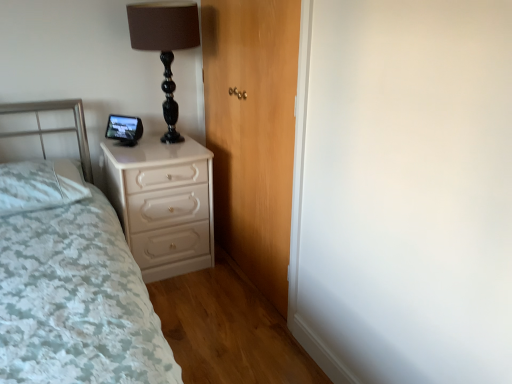
Locate an element on the screen. Image resolution: width=512 pixels, height=384 pixels. free space in front of white glossy chest of drawers at lower left is located at coordinates (188, 299).